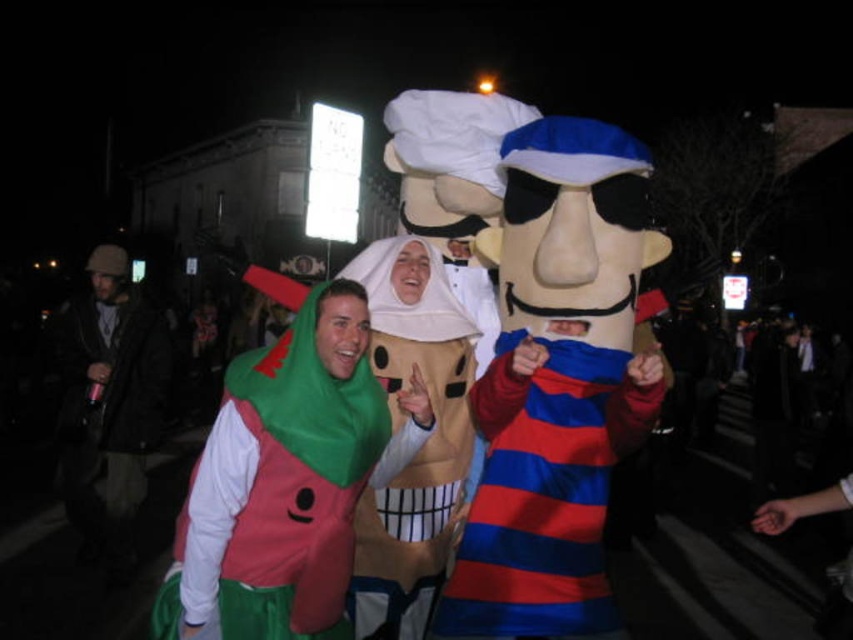
You are a photographer at the event and want to capture both the striped cotton shirt at center and the dark brown leather jacket at left in a single photo. Considering their heights, which one should you position closer to the camera to ensure both are fully visible?

The striped cotton shirt at center is not as tall as the dark brown leather jacket at left, so you should position the striped cotton shirt at center closer to the camera to ensure both are fully visible.

You are standing in the crowd watching the parade and want to take a photo of the two points mentioned. Which point, point (503, 381) or point (465, 470), is closer to you?

Point (503, 381) is closer to the viewer than point (465, 470).

You are a photographer at the event and need to capture a photo where the striped cotton shirt at center and smooth beige plushie at center are both visible. Based on their positions, which one should you ensure is closer to the top of the frame?

The smooth beige plushie at center should be closer to the top of the frame because the striped cotton shirt at center is located below it.